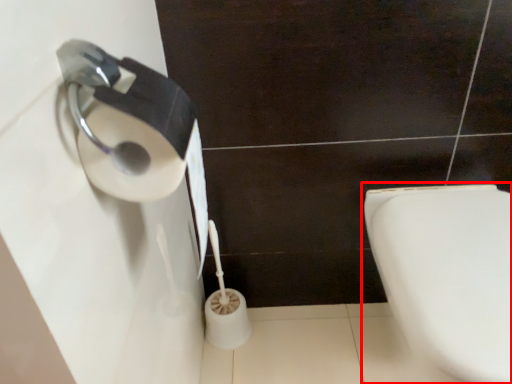
Question: From the image's perspective, what is the correct spatial relationship of toilet (annotated by the red box) in relation to toilet paper?

Choices:
 (A) below
 (B) above

Answer: (A)